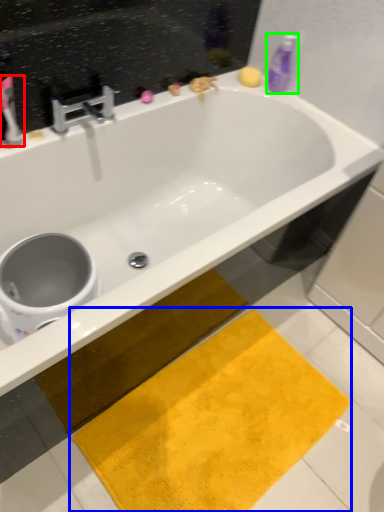
Question: Considering the real-world distances, which object is closest to toothbrush (highlighted by a red box)? beach towel (highlighted by a blue box) or cleaning product (highlighted by a green box).

Choices:
 (A) beach towel
 (B) cleaning product

Answer: (B)